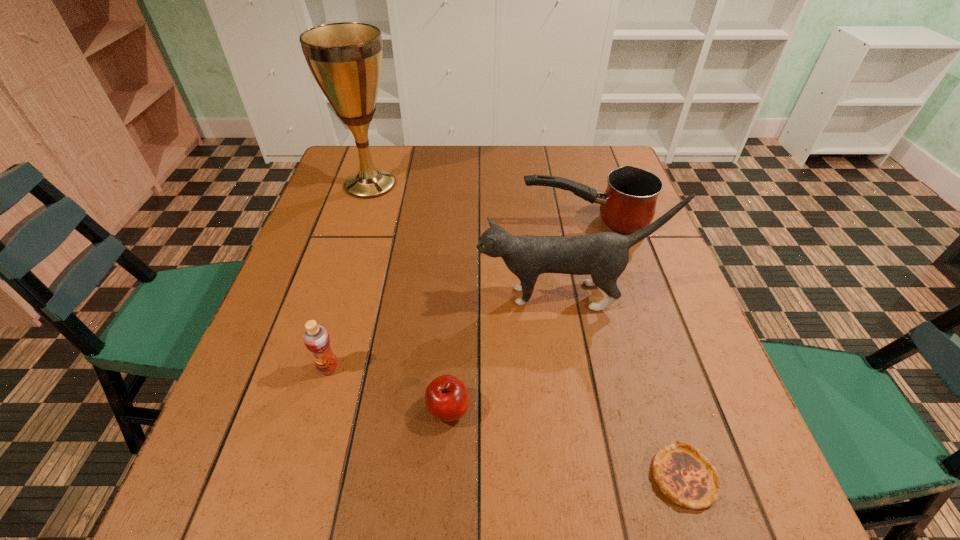
Where is `free location that satisfies the following two spatial constraints: 1. on the front side of the fifth farthest object; 2. on the right side of the nearest object`? free location that satisfies the following two spatial constraints: 1. on the front side of the fifth farthest object; 2. on the right side of the nearest object is located at coordinates (444, 477).